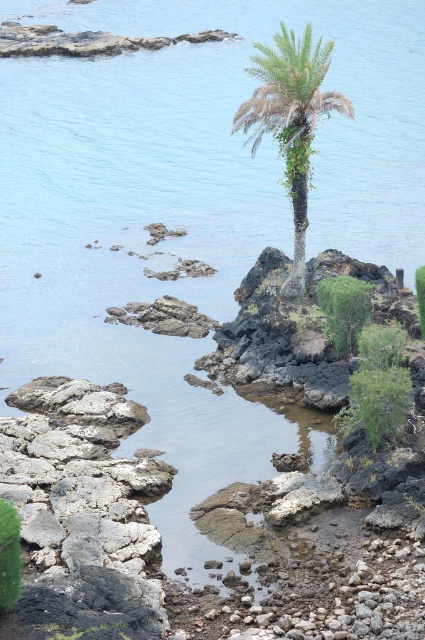
You are standing on the shore looking at the gray rough rock at lower left and the brown textured palm tree at center. Which object is closer to you?

The gray rough rock at lower left is closer to you because it is in front of the brown textured palm tree at center.

You are standing on the rocky island and want to place a small flag at each of the two points marked in the scene. The first point is at coordinates point [104,582] and the second at point [299,276]. If you want to place the flag closer to the palm tree first, which point should you choose?

Point [104,582] is closer to the viewer than point [299,276]. Since the palm tree is at the center of the island, the point closer to the viewer would be farther from the palm tree. Therefore, you should choose point [299,276] to place the flag closer to the palm tree first.